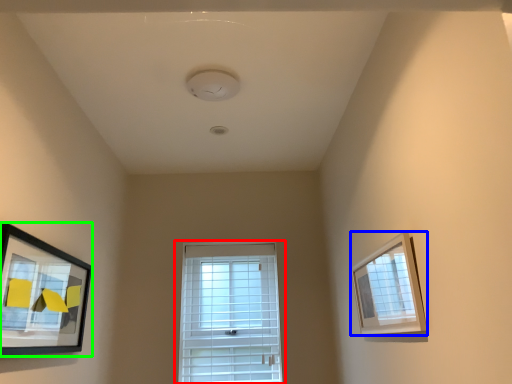
Question: Which object is positioned farthest from window (highlighted by a red box)? Select from picture frame (highlighted by a blue box) and picture frame (highlighted by a green box).

Choices:
 (A) picture frame
 (B) picture frame

Answer: (A)